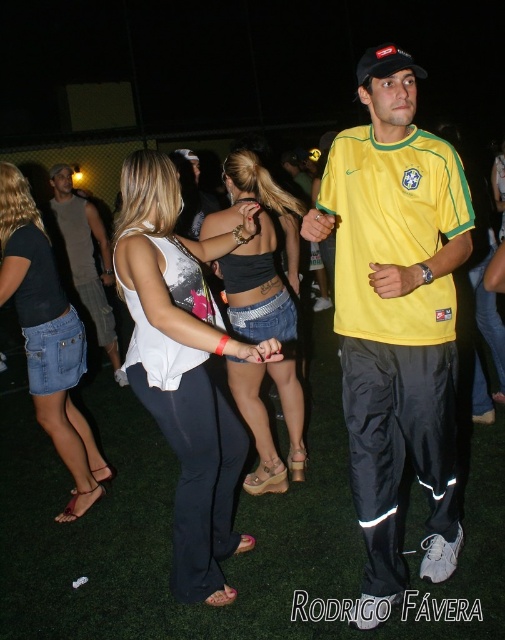
Does point (173, 176) come closer to viewer compared to point (0, 205)?

Yes.

Is white fabric top at center to the right of denim skirt at lower left from the viewer's perspective?

Correct, you'll find white fabric top at center to the right of denim skirt at lower left.

Measure the distance between white fabric top at center and camera.

white fabric top at center is 1.99 meters away from camera.

Where is `white fabric top at center`? This screenshot has height=640, width=505. white fabric top at center is located at coordinates (183, 365).

Which is below, yellow fabric shirt at center or white fabric top at center?

white fabric top at center

Can you confirm if yellow fabric shirt at center is taller than white fabric top at center?

Correct, yellow fabric shirt at center is much taller as white fabric top at center.

Find the location of a particular element. The width and height of the screenshot is (505, 640). yellow fabric shirt at center is located at coordinates (395, 316).

In the scene shown: Is yellow fabric shirt at center wider than denim shorts at left?

In fact, yellow fabric shirt at center might be narrower than denim shorts at left.

Is yellow fabric shirt at center to the right of denim shorts at left from the viewer's perspective?

Indeed, yellow fabric shirt at center is positioned on the right side of denim shorts at left.

This screenshot has width=505, height=640. What are the coordinates of `yellow fabric shirt at center` in the screenshot? It's located at (395, 316).